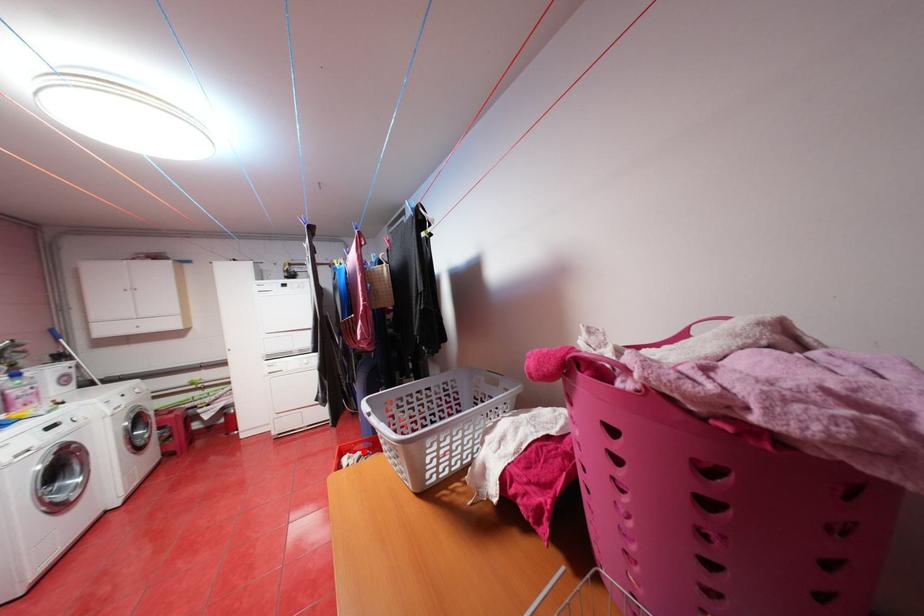
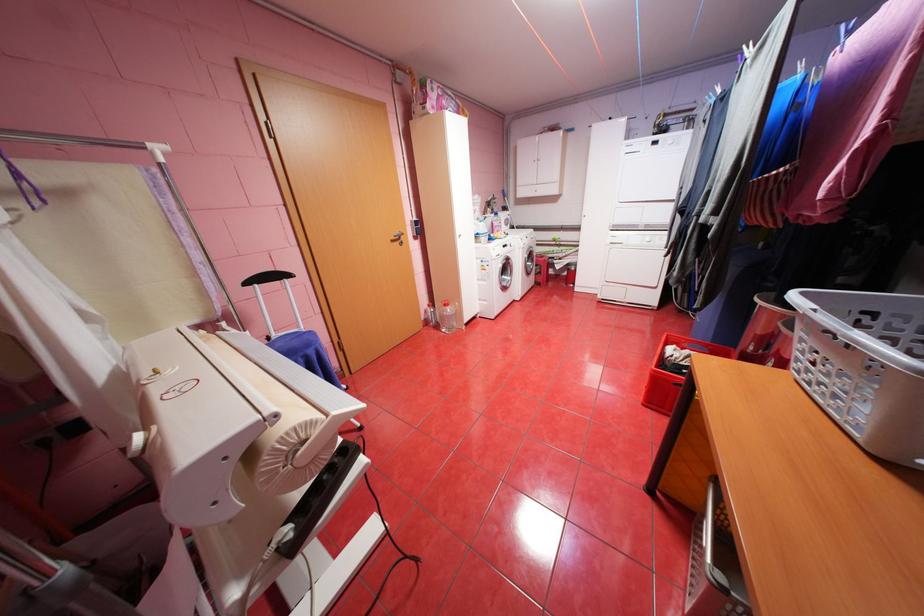
The point at the highlighted location is marked in the first image. Where is the corresponding point in the second image?

(691, 349)